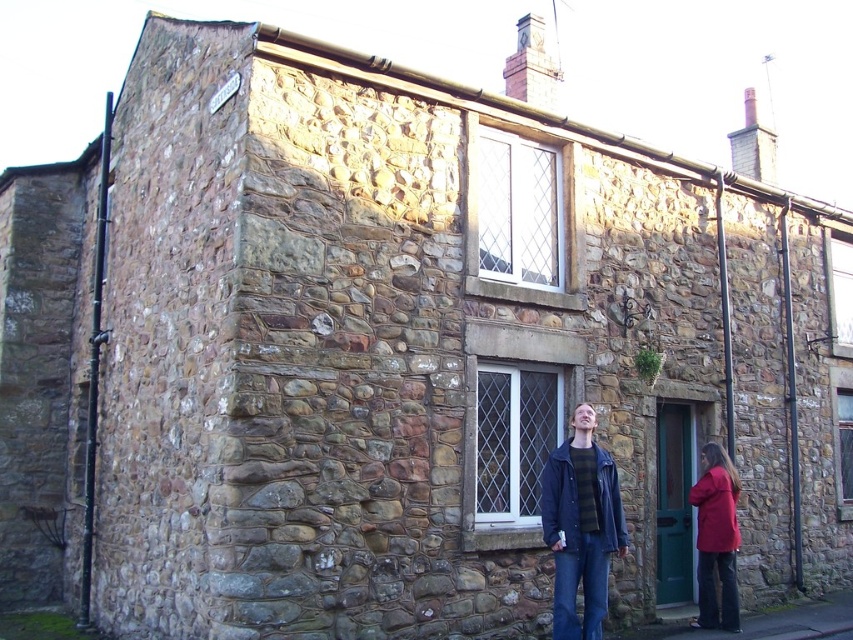
Question: Which point is farther to the camera?

Choices:
 (A) dark blue leather jacket at lower center
 (B) red fabric coat at lower right

Answer: (B)

Question: Considering the relative positions of dark blue leather jacket at lower center and red fabric coat at lower right in the image provided, where is dark blue leather jacket at lower center located with respect to red fabric coat at lower right?

Choices:
 (A) left
 (B) right

Answer: (A)

Question: Is dark blue leather jacket at lower center further to the viewer compared to red fabric coat at lower right?

Choices:
 (A) no
 (B) yes

Answer: (A)

Question: Observing the image, what is the correct spatial positioning of dark blue leather jacket at lower center in reference to red fabric coat at lower right?

Choices:
 (A) right
 (B) left

Answer: (B)

Question: Which point is closer to the camera?

Choices:
 (A) (730, 588)
 (B) (577, 435)

Answer: (B)